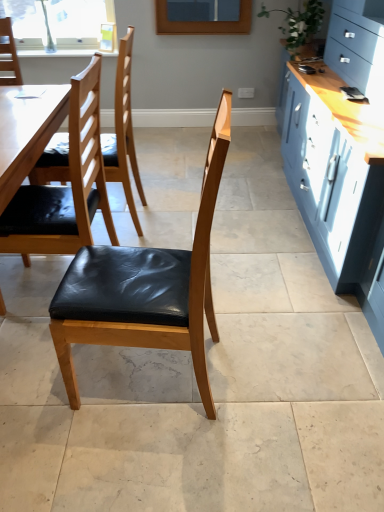
You are a GUI agent. You are given a task and a screenshot of the screen. Output one action in this format:
    pyautogui.click(x=<x>, y=<y>)
    Task: Click on the vacant point to the left of matte black leather chair at center, the 1th chair from the front
    
    Given the screenshot: What is the action you would take?
    pyautogui.click(x=44, y=397)